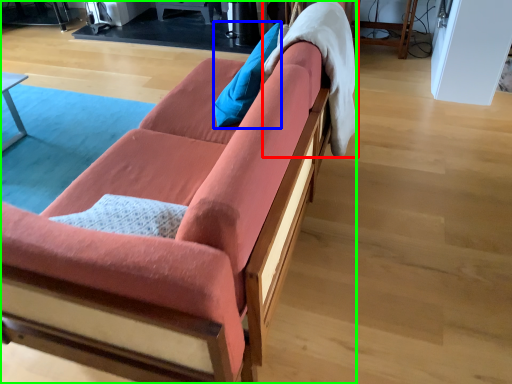
Question: Estimate the real-world distances between objects in this image. Which object is closer to blanket (highlighted by a red box), pillow (highlighted by a blue box) or studio couch (highlighted by a green box)?

Choices:
 (A) pillow
 (B) studio couch

Answer: (A)